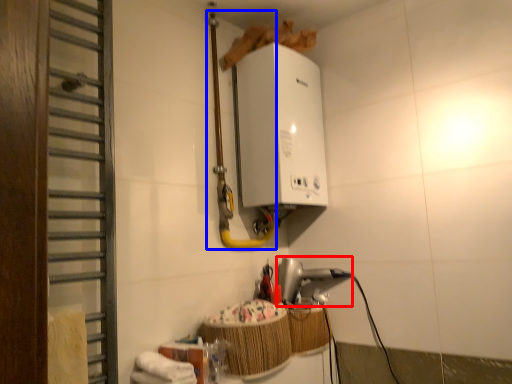
Question: Which object appears closest to the camera in this image, appliance (highlighted by a red box) or pipe (highlighted by a blue box)?

Choices:
 (A) appliance
 (B) pipe

Answer: (B)